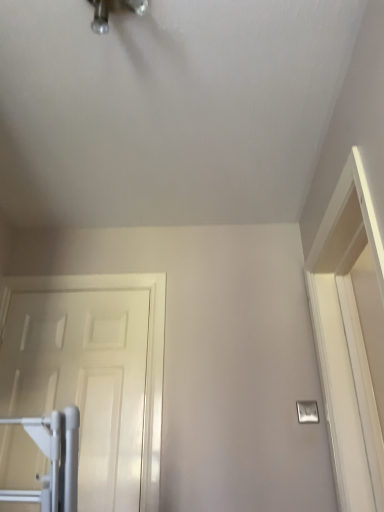
Locate an element on the screen. This screenshot has height=512, width=384. white glossy door at left is located at coordinates (83, 381).

What do you see at coordinates (83, 381) in the screenshot? I see `white glossy door at left` at bounding box center [83, 381].

Measure the distance between point (x=143, y=339) and camera.

A distance of 1.96 meters exists between point (x=143, y=339) and camera.

Where is `white glossy door at left`? white glossy door at left is located at coordinates (83, 381).